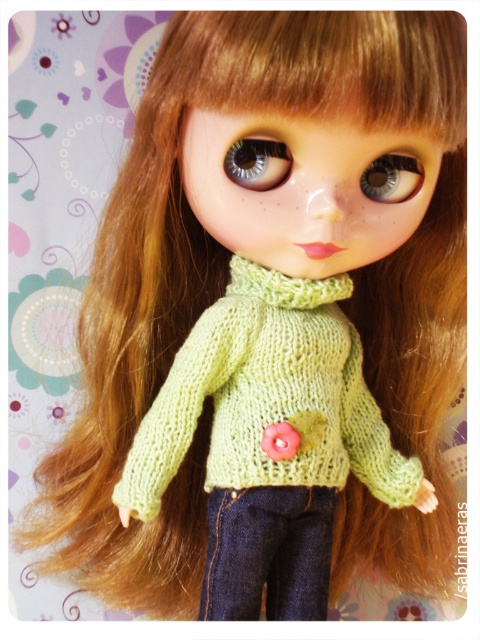
Question: Which point is farther to the camera?

Choices:
 (A) (257, 531)
 (B) (236, 147)
 (C) (389, 180)
 (D) (273, 294)

Answer: (A)

Question: Can you confirm if denim jeans at lower center is positioned below shiny gray eye at center?

Choices:
 (A) no
 (B) yes

Answer: (B)

Question: Is green knitted scarf at center behind shiny gray eye at center?

Choices:
 (A) yes
 (B) no

Answer: (A)

Question: Which point appears farthest from the camera in this image?

Choices:
 (A) (230, 280)
 (B) (313, 529)

Answer: (A)

Question: Which object is the closest to the denim jeans at lower center?

Choices:
 (A) green knitted scarf at center
 (B) knitted green cardigan at center
 (C) shiny gray eye at center

Answer: (B)

Question: In this image, where is green knitted scarf at center located relative to shiny gray eye at center?

Choices:
 (A) below
 (B) above

Answer: (A)